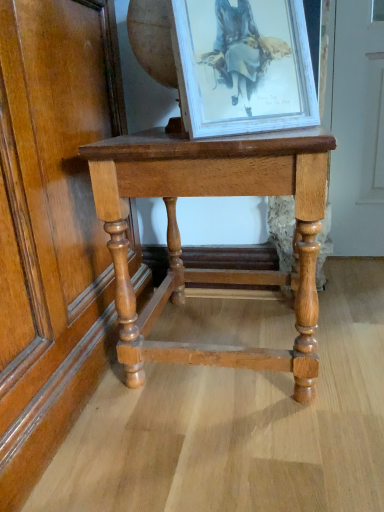
Question: In the image, is white wood picture frame at upper center positioned in front of or behind light brown wood table at center?

Choices:
 (A) front
 (B) behind

Answer: (A)

Question: In terms of height, does white wood picture frame at upper center look taller or shorter compared to light brown wood table at center?

Choices:
 (A) tall
 (B) short

Answer: (B)

Question: Is white wood picture frame at upper center wider or thinner than light brown wood table at center?

Choices:
 (A) wide
 (B) thin

Answer: (B)

Question: Is light brown wood table at center taller or shorter than white wood picture frame at upper center?

Choices:
 (A) tall
 (B) short

Answer: (A)

Question: Considering the positions of point (297, 169) and point (203, 68), is point (297, 169) closer or farther from the camera than point (203, 68)?

Choices:
 (A) closer
 (B) farther

Answer: (A)

Question: Would you say light brown wood table at center is inside or outside white wood picture frame at upper center?

Choices:
 (A) inside
 (B) outside

Answer: (B)

Question: Is light brown wood table at center in front of or behind white wood picture frame at upper center in the image?

Choices:
 (A) behind
 (B) front

Answer: (A)